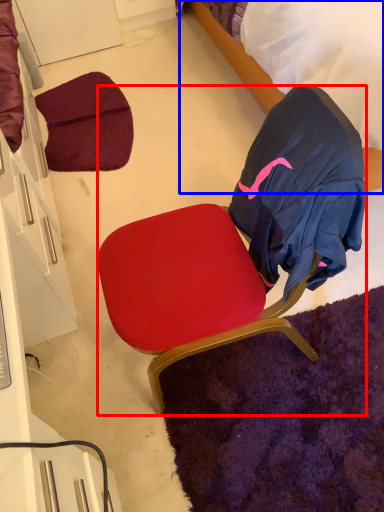
Question: Among these objects, which one is nearest to the camera, chair (highlighted by a red box) or bed (highlighted by a blue box)?

Choices:
 (A) chair
 (B) bed

Answer: (A)